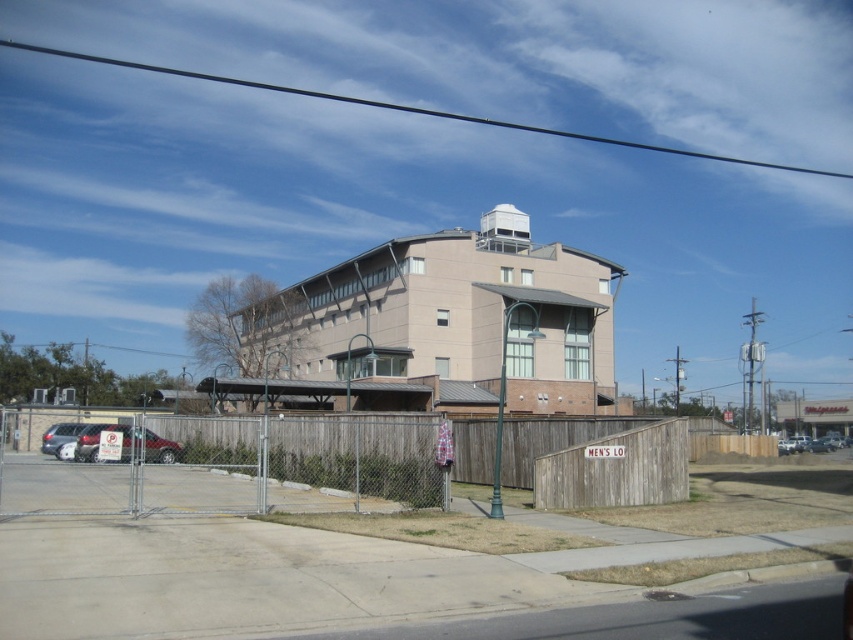
This screenshot has height=640, width=853. Identify the location of metal chain-link fence at lower center. (235, 467).

Is matte silver car at left positioned in front of silver metallic sedan at lower left?

Yes, matte silver car at left is in front of silver metallic sedan at lower left.

Which is in front, point (131, 449) or point (62, 433)?

Point (131, 449) is more forward.

Identify the location of matte silver car at left. This screenshot has width=853, height=640. (126, 444).

Can you confirm if metal chain-link fence at lower center is bigger than matte silver car at left?

Indeed, metal chain-link fence at lower center has a larger size compared to matte silver car at left.

Consider the image. Who is higher up, metal chain-link fence at lower center or matte silver car at left?

matte silver car at left

Looking at this image, who is more distant from viewer, (15, 506) or (144, 440)?

Positioned behind is point (15, 506).

Find the location of a particular element. The width and height of the screenshot is (853, 640). metal chain-link fence at lower center is located at coordinates (235, 467).